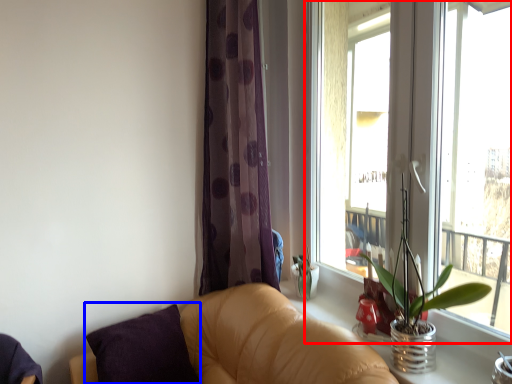
Question: Among these objects, which one is nearest to the camera, window (highlighted by a red box) or pillow (highlighted by a blue box)?

Choices:
 (A) window
 (B) pillow

Answer: (A)